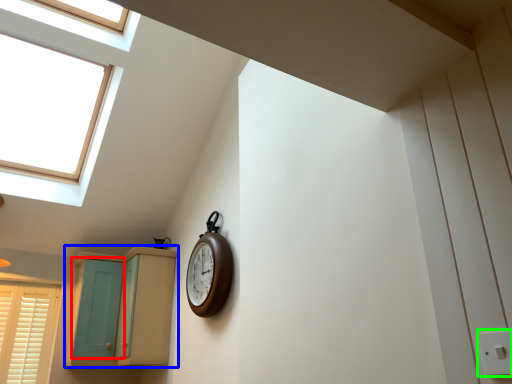
Question: Which object is the closest to the screen door (highlighted by a red box)? Choose among these: cabinetry (highlighted by a blue box) or electric outlet (highlighted by a green box).

Choices:
 (A) cabinetry
 (B) electric outlet

Answer: (A)